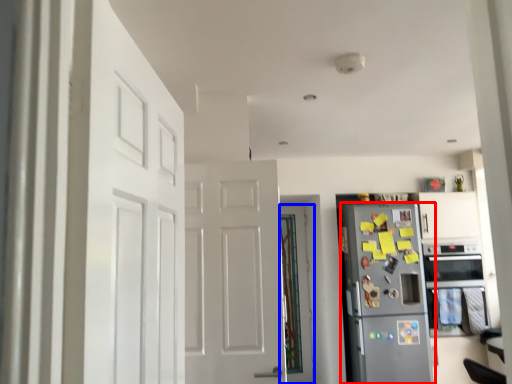
Question: Which object is further to the camera taking this photo, refrigerator (highlighted by a red box) or door (highlighted by a blue box)?

Choices:
 (A) refrigerator
 (B) door

Answer: (B)